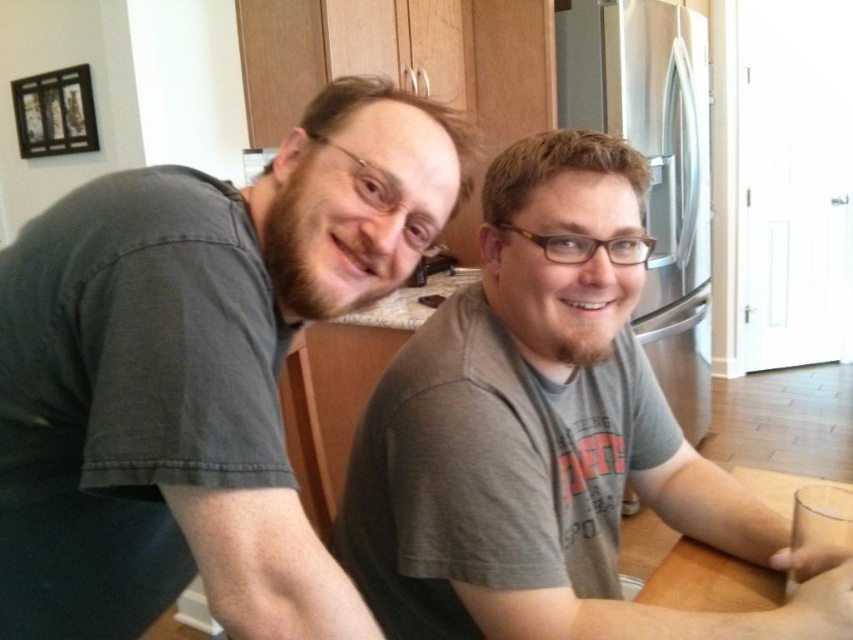
In the scene shown: Who is more distant from viewer, (x=552, y=321) or (x=697, y=564)?

Answer: Positioned behind is point (x=697, y=564).

In the scene shown: Who is more distant from viewer, (621, 602) or (733, 618)?

The point (621, 602) is more distant.

In order to click on gray cotton t-shirt at center in this screenshot , I will do `click(544, 435)`.

Does dark gray t-shirt at left have a lesser width compared to white laminate counter top at center?

Yes.

Where is `dark gray t-shirt at left`? dark gray t-shirt at left is located at coordinates (x=196, y=371).

This screenshot has width=853, height=640. I want to click on dark gray t-shirt at left, so click(196, 371).

Who is shorter, dark gray t-shirt at left or gray cotton t-shirt at center?

dark gray t-shirt at left

Is dark gray t-shirt at left thinner than gray cotton t-shirt at center?

Correct, dark gray t-shirt at left's width is less than gray cotton t-shirt at center's.

Describe the element at coordinates (196, 371) in the screenshot. I see `dark gray t-shirt at left` at that location.

Where is `dark gray t-shirt at left`? dark gray t-shirt at left is located at coordinates (196, 371).